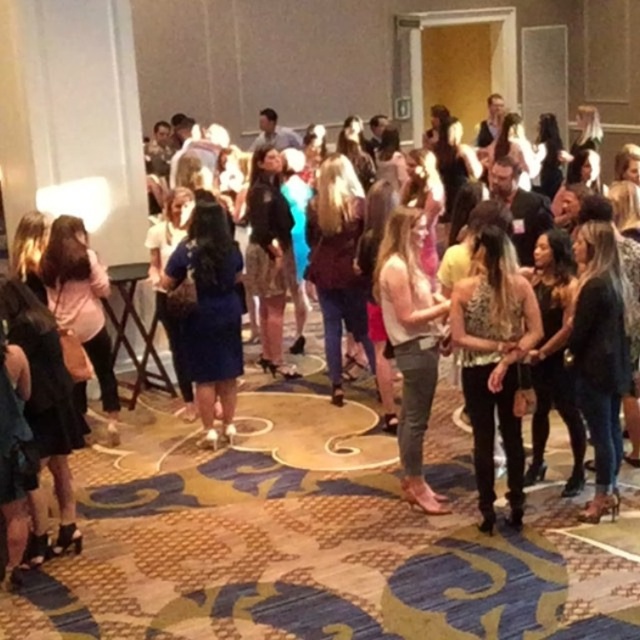
Question: Which point is closer to the camera taking this photo?

Choices:
 (A) (188, 273)
 (B) (422, 481)
 (C) (461, 340)

Answer: (C)

Question: Is leopard print top at center positioned at the back of blue satin dress at center?

Choices:
 (A) yes
 (B) no

Answer: (B)

Question: Which object appears farthest from the camera in this image?

Choices:
 (A) blue satin dress at center
 (B) denim jeans at center

Answer: (A)

Question: Estimate the real-world distances between objects in this image. Which object is farther from the blue satin dress at center?

Choices:
 (A) leopard print top at center
 (B) denim jeans at center

Answer: (A)

Question: Does leopard print top at center have a smaller size compared to denim jeans at center?

Choices:
 (A) no
 (B) yes

Answer: (B)

Question: Does blue satin dress at center appear under denim jeans at center?

Choices:
 (A) no
 (B) yes

Answer: (A)